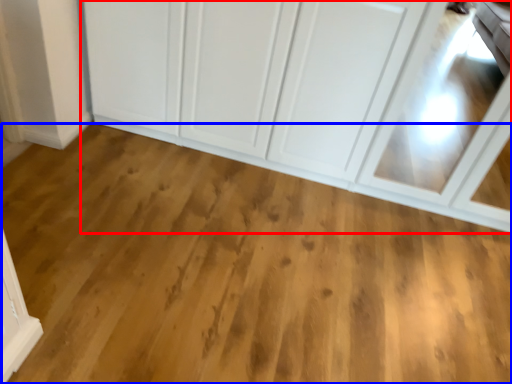
Question: Which object is further to the camera taking this photo, cupboard (highlighted by a red box) or plain (highlighted by a blue box)?

Choices:
 (A) cupboard
 (B) plain

Answer: (A)